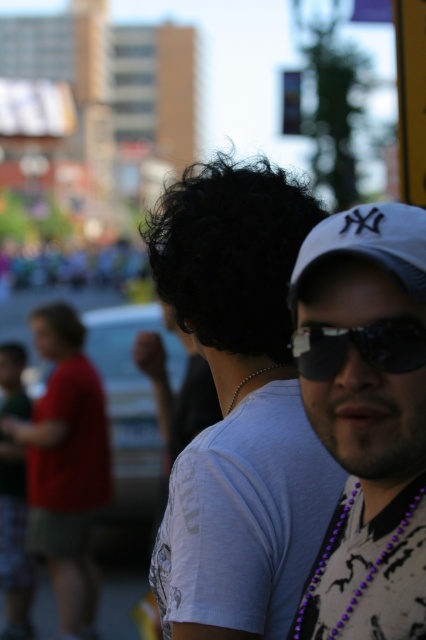
Can you confirm if purple beaded necklace at lower right is positioned to the right of white matte baseball cap at right?

Incorrect, purple beaded necklace at lower right is not on the right side of white matte baseball cap at right.

Is the position of purple beaded necklace at lower right less distant than that of white matte baseball cap at right?

Yes, it is in front of white matte baseball cap at right.

What do you see at coordinates (368, 572) in the screenshot? I see `purple beaded necklace at lower right` at bounding box center [368, 572].

Locate an element on the screen. The height and width of the screenshot is (640, 426). purple beaded necklace at lower right is located at coordinates (368, 572).

Does white t-shirt at center have a greater height compared to black reflective sunglasses at center?

Yes, white t-shirt at center is taller than black reflective sunglasses at center.

Is white t-shirt at center further to the viewer compared to black reflective sunglasses at center?

That is True.

This screenshot has width=426, height=640. Find the location of `white t-shirt at center`. white t-shirt at center is located at coordinates (238, 408).

Where is `white t-shirt at center`? This screenshot has width=426, height=640. white t-shirt at center is located at coordinates (238, 408).

Looking at this image, does purple beaded necklace at lower right have a greater width compared to pearl necklace at upper center?

Indeed, purple beaded necklace at lower right has a greater width compared to pearl necklace at upper center.

Does purple beaded necklace at lower right have a lesser height compared to pearl necklace at upper center?

No.

Where is `purple beaded necklace at lower right`? purple beaded necklace at lower right is located at coordinates (368, 572).